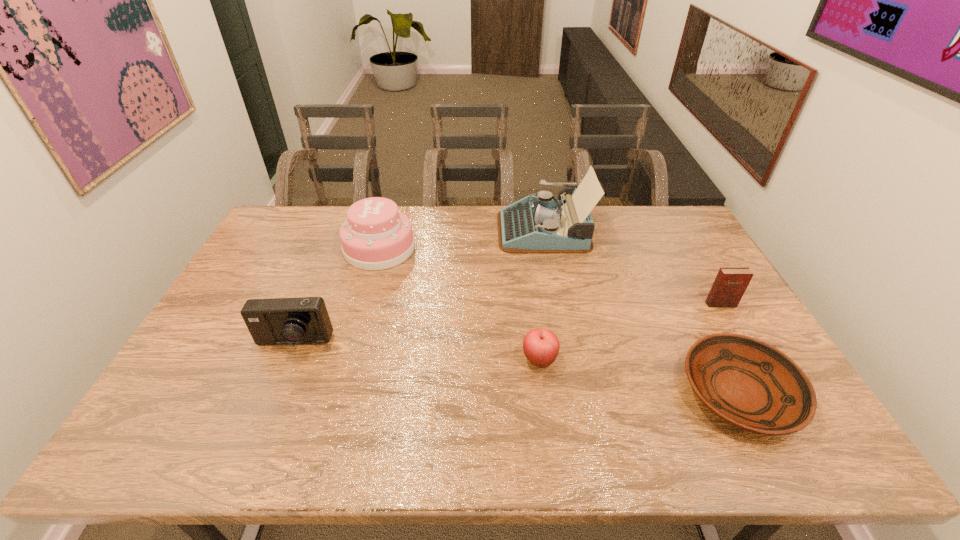
The height and width of the screenshot is (540, 960). I want to click on typewriter, so click(x=540, y=224).

Where is `birthday cake`? This screenshot has height=540, width=960. birthday cake is located at coordinates 376,236.

You are a GUI agent. You are given a task and a screenshot of the screen. Output one action in this format:
    pyautogui.click(x=<x>, y=<y>)
    Task: Click on the camera
    
    Given the screenshot: What is the action you would take?
    pyautogui.click(x=304, y=320)

The image size is (960, 540). Identify the location of the fourth nearest object. (730, 284).

Where is `the fifth tallest object`? the fifth tallest object is located at coordinates (541, 346).

What are the coordinates of `the shortest object` in the screenshot? It's located at (748, 383).

Find the location of a particular element. The height and width of the screenshot is (540, 960). free space located on the typing side of the typewriter is located at coordinates (441, 230).

The height and width of the screenshot is (540, 960). Identify the location of free location located 0.240m on the typing side of the typewriter. click(x=432, y=230).

This screenshot has width=960, height=540. Find the location of `free space located 0.100m on the typing side of the typewriter`. free space located 0.100m on the typing side of the typewriter is located at coordinates [470, 230].

I want to click on vacant area situated on the left of the birthday cake, so click(260, 248).